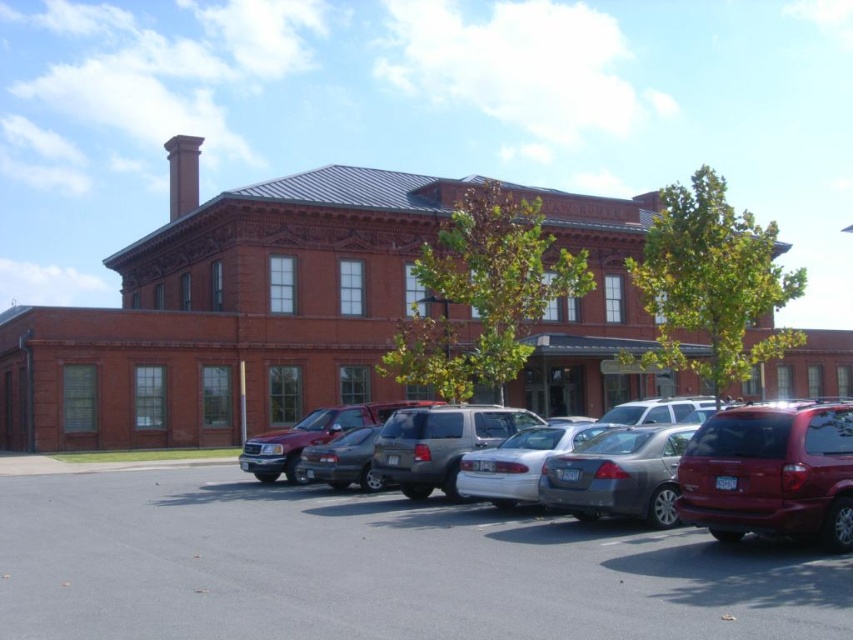
Question: Does silver metallic suv at center have a greater width compared to red brick chimney at upper left?

Choices:
 (A) no
 (B) yes

Answer: (A)

Question: Which object is positioned closest to the red brick chimney at upper left?

Choices:
 (A) satin silver sedan at center
 (B) gray asphalt parking lot at lower center

Answer: (A)

Question: Can you confirm if glossy red suv at right is positioned below red brick chimney at upper left?

Choices:
 (A) yes
 (B) no

Answer: (A)

Question: Which point is farther to the camera?

Choices:
 (A) (618, 484)
 (B) (599, 625)
 (C) (630, 442)
 (D) (181, 145)

Answer: (D)

Question: Which object is closer to the camera taking this photo?

Choices:
 (A) silver metallic suv at center
 (B) gray asphalt parking lot at lower center

Answer: (B)

Question: Considering the relative positions of gray asphalt parking lot at lower center and red brick chimney at upper left in the image provided, where is gray asphalt parking lot at lower center located with respect to red brick chimney at upper left?

Choices:
 (A) right
 (B) left

Answer: (A)